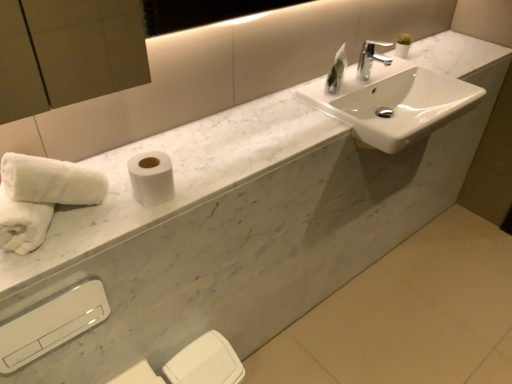
The image size is (512, 384). I want to click on free space on the front side of white matte toilet paper at center, positioned as the 1th toilet paper in front-to-back order, so click(x=115, y=226).